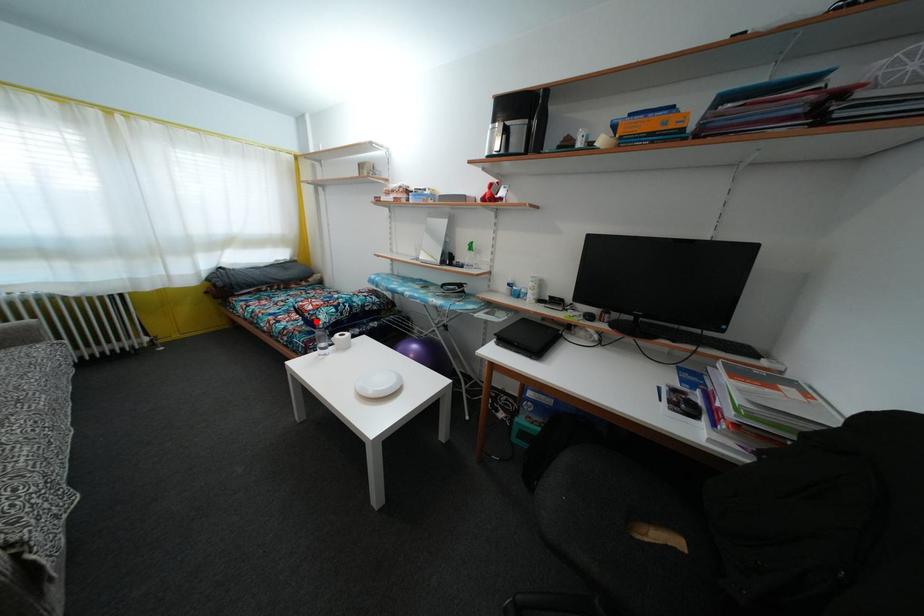
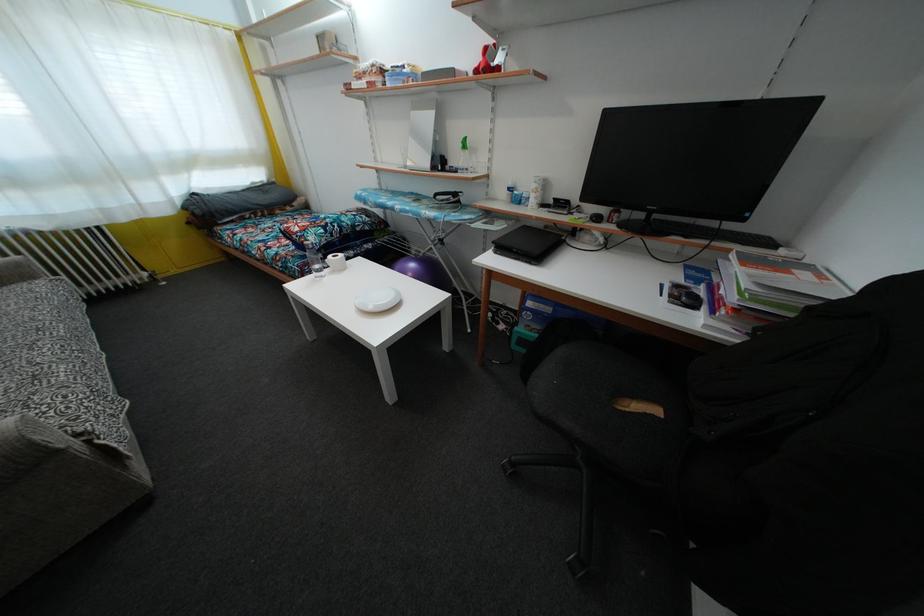
Question: I am providing you with two images of the same scene from different viewpoints. Image1 has a red point marked. In image2, the corresponding 3D location appears at what relative position? Reply with the corresponding letter.

Choices:
 (A) Closer
 (B) Farther

Answer: (A)